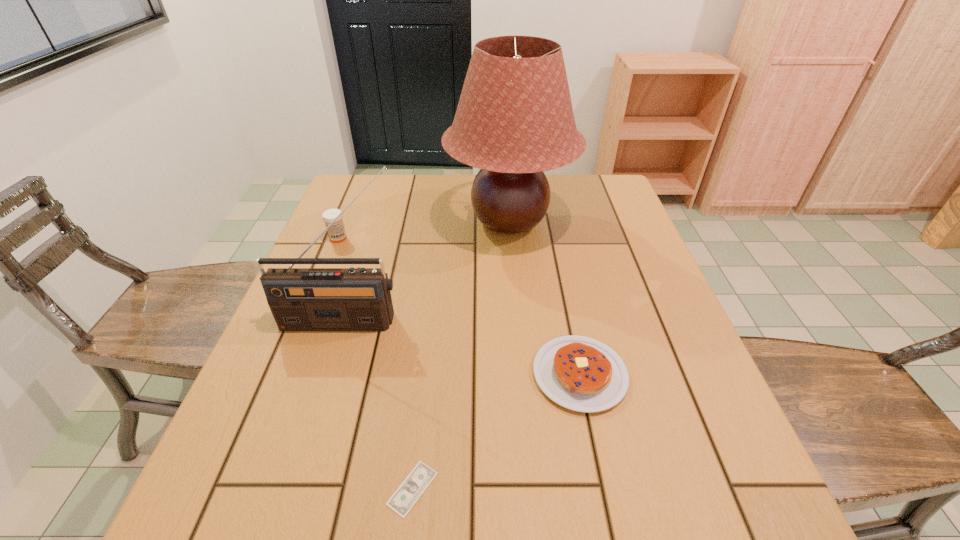
The height and width of the screenshot is (540, 960). In order to click on free space located on the front of the third tallest object in this screenshot , I will do `click(324, 272)`.

Find the location of `vacant space located 0.100m on the front of the pancake`. vacant space located 0.100m on the front of the pancake is located at coordinates (599, 469).

Where is `vacant area located 0.310m on the back of the nearest object`? This screenshot has height=540, width=960. vacant area located 0.310m on the back of the nearest object is located at coordinates (431, 325).

In order to click on object that is positioned at the far edge in this screenshot , I will do pyautogui.click(x=514, y=120).

Identify the location of object at the near edge. The width and height of the screenshot is (960, 540). (411, 489).

This screenshot has width=960, height=540. Identify the location of radio receiver that is at the left edge. (301, 299).

Locate an element on the screen. medicine that is at the left edge is located at coordinates (336, 232).

Identify the location of object that is positioned at the right edge. (580, 373).

The height and width of the screenshot is (540, 960). In the image, there is a desktop. In order to click on vacant space at the far edge in this screenshot , I will do `click(416, 195)`.

The image size is (960, 540). In the image, there is a desktop. In order to click on vacant space at the near edge in this screenshot , I will do `click(551, 523)`.